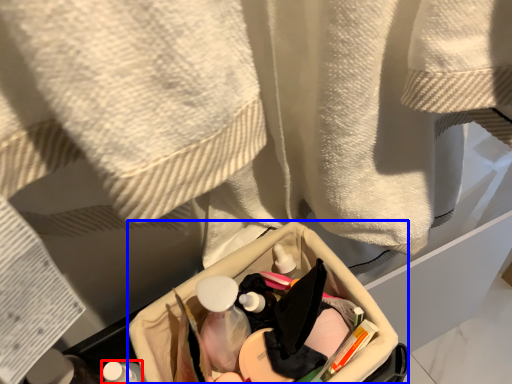
Question: Which object appears farthest to the camera in this image, toiletry (highlighted by a red box) or storage box (highlighted by a blue box)?

Choices:
 (A) toiletry
 (B) storage box

Answer: (B)